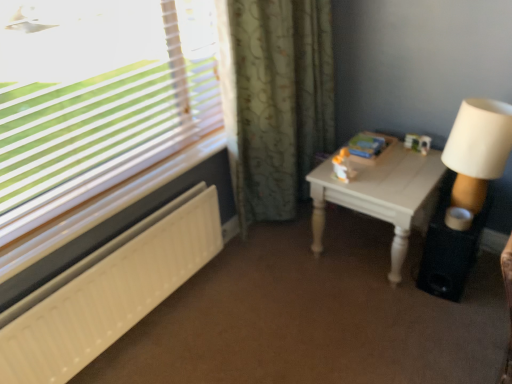
Find the location of a particular element. vacant space underneath white wood table at right (from a real-world perspective) is located at coordinates (359, 254).